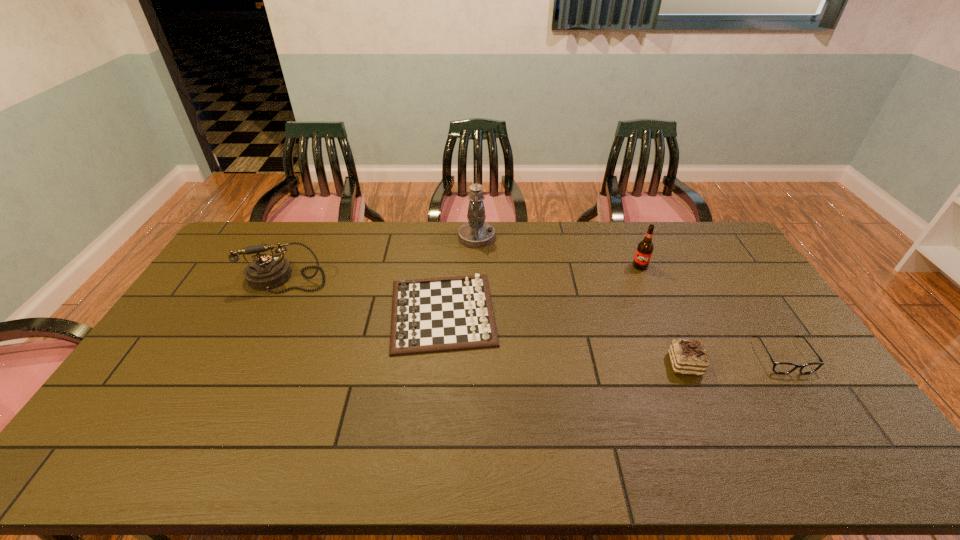
Locate an element on the screen. The image size is (960, 540). oil lamp is located at coordinates (476, 233).

The width and height of the screenshot is (960, 540). In order to click on the tallest object in this screenshot , I will do `click(476, 233)`.

Where is `root beer`? The width and height of the screenshot is (960, 540). root beer is located at coordinates (644, 251).

Identify the location of telephone. (266, 272).

What are the coordinates of `chocolate cake` in the screenshot? It's located at (687, 356).

Locate an element on the screen. The height and width of the screenshot is (540, 960). chessboard is located at coordinates pyautogui.click(x=432, y=315).

Image resolution: width=960 pixels, height=540 pixels. In order to click on the shortest object in this screenshot , I will do `click(778, 367)`.

Locate an element on the screen. spectacles is located at coordinates (778, 367).

Locate an element on the screen. Image resolution: width=960 pixels, height=540 pixels. vacant area situated on the front of the tallest object is located at coordinates (476, 274).

Where is `vacant point located 0.290m on the front of the root beer`? Image resolution: width=960 pixels, height=540 pixels. vacant point located 0.290m on the front of the root beer is located at coordinates (668, 332).